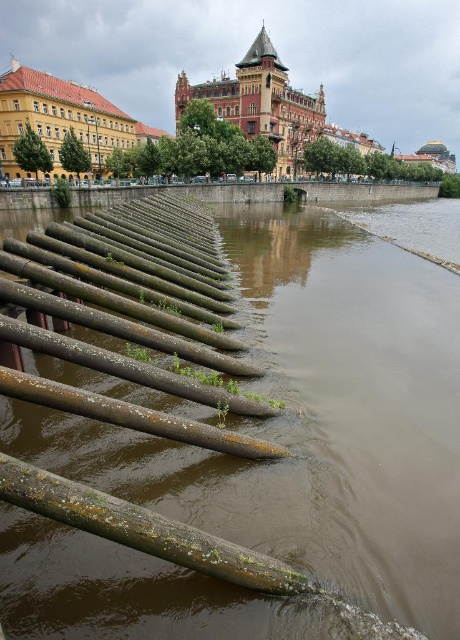
Question: Can you confirm if brown concrete river at lower left is smaller than green mossy log at lower left?

Choices:
 (A) no
 (B) yes

Answer: (A)

Question: Which of the following is the closest to the observer?

Choices:
 (A) (122, 515)
 (B) (348, 538)

Answer: (A)

Question: Is brown concrete river at lower left above green mossy log at lower left?

Choices:
 (A) yes
 (B) no

Answer: (A)

Question: Observing the image, what is the correct spatial positioning of brown concrete river at lower left in reference to green mossy log at lower left?

Choices:
 (A) below
 (B) above

Answer: (B)

Question: Which point appears closest to the camera in this image?

Choices:
 (A) (420, 420)
 (B) (283, 563)

Answer: (B)